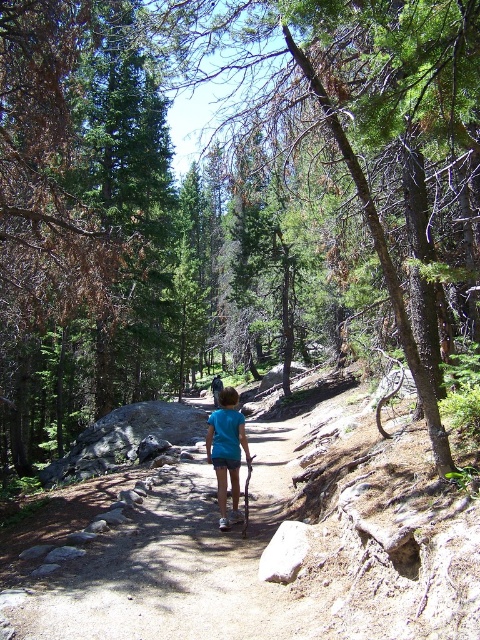
Question: Is blue cotton shirt at center to the left of blue fabric shirt at center from the viewer's perspective?

Choices:
 (A) no
 (B) yes

Answer: (A)

Question: Is blue cotton shirt at center closer to camera compared to blue fabric shirt at center?

Choices:
 (A) yes
 (B) no

Answer: (A)

Question: Which point is closer to the camera?

Choices:
 (A) blue fabric shirt at center
 (B) blue cotton shirt at center

Answer: (B)

Question: Does blue cotton shirt at center have a smaller size compared to blue fabric shirt at center?

Choices:
 (A) no
 (B) yes

Answer: (B)

Question: Which point is farther to the camera?

Choices:
 (A) (216, 388)
 (B) (224, 483)

Answer: (A)